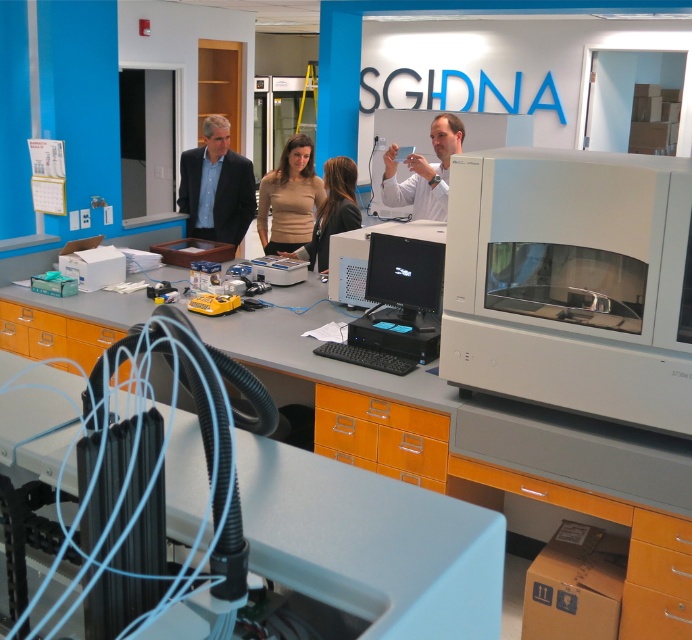
Question: Where is matte beige shirt at center located in relation to black plastic keyboard at center in the image?

Choices:
 (A) above
 (B) below

Answer: (A)

Question: Which object appears closest to the camera in this image?

Choices:
 (A) matte beige sweater at center
 (B) orange matte/file cabinet at lower center
 (C) matte black monitor at center

Answer: (B)

Question: Is orange matte/file cabinet at lower center in front of matte black monitor at center?

Choices:
 (A) no
 (B) yes

Answer: (B)

Question: Does orange matte/file cabinet at lower center appear over matte beige sweater at center?

Choices:
 (A) yes
 (B) no

Answer: (B)

Question: Which object appears closest to the camera in this image?

Choices:
 (A) matte black monitor at center
 (B) white lab coat at center
 (C) matte beige sweater at center

Answer: (A)

Question: Which of the following is the farthest from the observer?

Choices:
 (A) orange matte/file cabinet at lower center
 (B) matte beige shirt at center

Answer: (B)